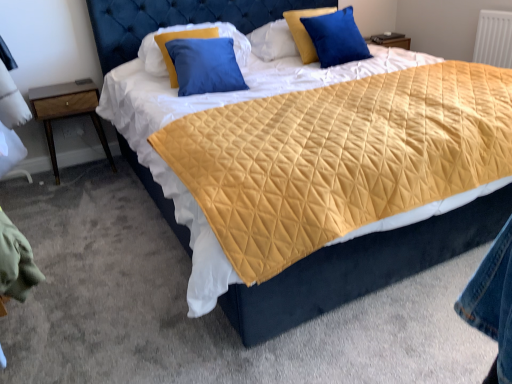
What do you see at coordinates (184, 38) in the screenshot? This screenshot has width=512, height=384. I see `blue velvet pillow at upper center, the 3th pillow in the right-to-left sequence` at bounding box center [184, 38].

Describe the element at coordinates (336, 37) in the screenshot. I see `blue satin pillow at upper right, which ranks as the 1th pillow in right-to-left order` at that location.

In order to click on wooden nightstand at left in this screenshot , I will do `click(67, 111)`.

What's the angular difference between wooden nightstand at left and blue satin pillow at upper right, which ranks as the 1th pillow in right-to-left order,'s facing directions?

The angle between the facing direction of wooden nightstand at left and the facing direction of blue satin pillow at upper right, which ranks as the 1th pillow in right-to-left order, is 5.33 degrees.

From a real-world perspective, relative to blue satin pillow at upper right, which ranks as the 1th pillow in right-to-left order, is wooden nightstand at left vertically above or below?

In terms of real-world spatial position, wooden nightstand at left is below blue satin pillow at upper right, which ranks as the 1th pillow in right-to-left order.

Is wooden nightstand at left bigger than blue satin pillow at upper right, the third pillow positioned from the left?

Correct, wooden nightstand at left is larger in size than blue satin pillow at upper right, the third pillow positioned from the left.

Does wooden nightstand at left come behind blue satin pillow at upper right, which ranks as the 1th pillow in right-to-left order?

Yes, it is.

Is blue satin pillow at upper right, which ranks as the 1th pillow in right-to-left order, located within blue velvet pillow at upper center, arranged as the first pillow when viewed from the left?

No, blue velvet pillow at upper center, arranged as the first pillow when viewed from the left, does not contain blue satin pillow at upper right, which ranks as the 1th pillow in right-to-left order.

From the image's perspective, which one is positioned lower, blue velvet pillow at upper center, arranged as the first pillow when viewed from the left, or blue satin pillow at upper right, which ranks as the 1th pillow in right-to-left order?

blue velvet pillow at upper center, arranged as the first pillow when viewed from the left, appears lower in the image.

Based on the photo, is blue satin pillow at upper right, the third pillow positioned from the left, at the back of blue velvet pillow at upper center, the 3th pillow in the right-to-left sequence?

blue velvet pillow at upper center, the 3th pillow in the right-to-left sequence, does not have its back to blue satin pillow at upper right, the third pillow positioned from the left.

Which object is positioned more to the left, blue velvet pillow at upper center, the 3th pillow in the right-to-left sequence, or blue satin pillow at upper right, which ranks as the 1th pillow in right-to-left order?

blue velvet pillow at upper center, the 3th pillow in the right-to-left sequence.

In terms of width, does blue satin pillow at upper right, which ranks as the 1th pillow in right-to-left order, look wider or thinner when compared to blue velvet pillow at upper center, arranged as the first pillow when viewed from the left?

In the image, blue satin pillow at upper right, which ranks as the 1th pillow in right-to-left order, appears to be more narrow than blue velvet pillow at upper center, arranged as the first pillow when viewed from the left.

From the image's perspective, which pillow is the 1st one above the blue velvet pillow at upper center, arranged as the first pillow when viewed from the left? Please provide its 2D coordinates.

[(336, 37)]

From the picture: Considering the relative sizes of blue satin pillow at upper right, the third pillow positioned from the left, and blue velvet pillow at upper center, the 3th pillow in the right-to-left sequence, in the image provided, is blue satin pillow at upper right, the third pillow positioned from the left, smaller than blue velvet pillow at upper center, the 3th pillow in the right-to-left sequence,?

Yes.

Is blue satin pillow at upper right, which ranks as the 1th pillow in right-to-left order, turned away from blue velvet pillow at upper center, the 3th pillow in the right-to-left sequence?

blue satin pillow at upper right, which ranks as the 1th pillow in right-to-left order, does not have its back to blue velvet pillow at upper center, the 3th pillow in the right-to-left sequence.

Can wooden nightstand at left be found inside blue velvet pillow at upper center, the 3th pillow in the right-to-left sequence?

No, wooden nightstand at left is not inside blue velvet pillow at upper center, the 3th pillow in the right-to-left sequence.

Considering the sizes of objects blue velvet pillow at upper center, the 3th pillow in the right-to-left sequence, and wooden nightstand at left in the image provided, who is shorter, blue velvet pillow at upper center, the 3th pillow in the right-to-left sequence, or wooden nightstand at left?

blue velvet pillow at upper center, the 3th pillow in the right-to-left sequence, is shorter.

Is blue velvet pillow at upper center, the 3th pillow in the right-to-left sequence, placed right next to wooden nightstand at left?

There is a gap between blue velvet pillow at upper center, the 3th pillow in the right-to-left sequence, and wooden nightstand at left.

What are the coordinates of `the 2nd pillow in front when counting from the wooden nightstand at left` in the screenshot? It's located at [x=184, y=38].

Can you confirm if wooden nightstand at left is taller than blue velvet pillow at upper center, the 3th pillow in the right-to-left sequence?

Correct, wooden nightstand at left is much taller as blue velvet pillow at upper center, the 3th pillow in the right-to-left sequence.

Between wooden nightstand at left and blue velvet pillow at upper center, the 3th pillow in the right-to-left sequence, which one is positioned behind?

wooden nightstand at left.

From a real-world perspective, which object stands above the other?

blue velvet pillow at upper center, arranged as the first pillow when viewed from the left, from a real-world perspective.

Can you confirm if blue velvet pillow at upper center, the 3th pillow in the right-to-left sequence, is wider than velvet blue pillow at upper center, the 2th pillow positioned from the left?

Indeed, blue velvet pillow at upper center, the 3th pillow in the right-to-left sequence, has a greater width compared to velvet blue pillow at upper center, the 2th pillow positioned from the left.

Is velvet blue pillow at upper center, the 2th pillow positioned from the left, surrounded by blue velvet pillow at upper center, arranged as the first pillow when viewed from the left?

No, velvet blue pillow at upper center, the 2th pillow positioned from the left, is not a part of blue velvet pillow at upper center, arranged as the first pillow when viewed from the left.

Is blue velvet pillow at upper center, the 3th pillow in the right-to-left sequence, facing towards velvet blue pillow at upper center, the second pillow viewed from the right?

No, blue velvet pillow at upper center, the 3th pillow in the right-to-left sequence, is not facing towards velvet blue pillow at upper center, the second pillow viewed from the right.

Considering the positions of objects velvet blue pillow at upper center, the second pillow viewed from the right, and blue satin pillow at upper right, the third pillow positioned from the left, in the image provided, who is behind, velvet blue pillow at upper center, the second pillow viewed from the right, or blue satin pillow at upper right, the third pillow positioned from the left,?

velvet blue pillow at upper center, the second pillow viewed from the right, is further from the camera.

Does velvet blue pillow at upper center, the second pillow viewed from the right, turn towards blue satin pillow at upper right, which ranks as the 1th pillow in right-to-left order?

Yes, velvet blue pillow at upper center, the second pillow viewed from the right, is facing blue satin pillow at upper right, which ranks as the 1th pillow in right-to-left order.

Are velvet blue pillow at upper center, the 2th pillow positioned from the left, and blue satin pillow at upper right, which ranks as the 1th pillow in right-to-left order, beside each other?

No, velvet blue pillow at upper center, the 2th pillow positioned from the left, is not next to blue satin pillow at upper right, which ranks as the 1th pillow in right-to-left order.

From a real-world perspective, is velvet blue pillow at upper center, the second pillow viewed from the right, positioned under blue satin pillow at upper right, the third pillow positioned from the left, based on gravity?

Correct, in the physical world, velvet blue pillow at upper center, the second pillow viewed from the right, is lower than blue satin pillow at upper right, the third pillow positioned from the left.

Image resolution: width=512 pixels, height=384 pixels. I want to click on the 3rd pillow to the right when counting from the wooden nightstand at left, so click(x=336, y=37).

Locate an element on the screen. This screenshot has width=512, height=384. pillow that is below the blue satin pillow at upper right, which ranks as the 1th pillow in right-to-left order (from the image's perspective) is located at coordinates (184, 38).

Which object lies nearer to the anchor point blue velvet pillow at upper center, the 3th pillow in the right-to-left sequence, blue satin pillow at upper right, the third pillow positioned from the left, or velvet blue pillow at upper center, the second pillow viewed from the right?

velvet blue pillow at upper center, the second pillow viewed from the right, is closer to blue velvet pillow at upper center, the 3th pillow in the right-to-left sequence.

Considering their positions, is blue satin pillow at upper right, the third pillow positioned from the left, positioned closer to blue velvet pillow at upper center, the 3th pillow in the right-to-left sequence, than wooden nightstand at left?

wooden nightstand at left is positioned closer to the anchor blue velvet pillow at upper center, the 3th pillow in the right-to-left sequence.

Looking at the image, which one is located closer to wooden nightstand at left, blue satin pillow at upper right, which ranks as the 1th pillow in right-to-left order, or velvet blue pillow at upper center, the second pillow viewed from the right?

velvet blue pillow at upper center, the second pillow viewed from the right, is closer to wooden nightstand at left.

Considering their positions, is wooden nightstand at left positioned further to blue velvet pillow at upper center, the 3th pillow in the right-to-left sequence, than blue satin pillow at upper right, which ranks as the 1th pillow in right-to-left order?

blue satin pillow at upper right, which ranks as the 1th pillow in right-to-left order, is further to blue velvet pillow at upper center, the 3th pillow in the right-to-left sequence.

Estimate the real-world distances between objects in this image. Which object is further from blue satin pillow at upper right, the third pillow positioned from the left, wooden nightstand at left or velvet blue pillow at upper center, the second pillow viewed from the right?

Based on the image, wooden nightstand at left appears to be further to blue satin pillow at upper right, the third pillow positioned from the left.

From the image, which object appears to be nearer to wooden nightstand at left, velvet blue pillow at upper center, the 2th pillow positioned from the left, or blue velvet pillow at upper center, the 3th pillow in the right-to-left sequence?

blue velvet pillow at upper center, the 3th pillow in the right-to-left sequence.

Which object lies nearer to the anchor point velvet blue pillow at upper center, the 2th pillow positioned from the left, blue satin pillow at upper right, the third pillow positioned from the left, or blue velvet pillow at upper center, arranged as the first pillow when viewed from the left?

Among the two, blue satin pillow at upper right, the third pillow positioned from the left, is located nearer to velvet blue pillow at upper center, the 2th pillow positioned from the left.

Looking at the image, which one is located further to wooden nightstand at left, blue velvet pillow at upper center, arranged as the first pillow when viewed from the left, or velvet blue pillow at upper center, the second pillow viewed from the right?

velvet blue pillow at upper center, the second pillow viewed from the right, is positioned further to the anchor wooden nightstand at left.

Where is `pillow located between wooden nightstand at left and velvet blue pillow at upper center, the 2th pillow positioned from the left, in the left-right direction`? This screenshot has height=384, width=512. pillow located between wooden nightstand at left and velvet blue pillow at upper center, the 2th pillow positioned from the left, in the left-right direction is located at coordinates (184, 38).

At what (x,y) coordinates should I click in order to perform the action: click on pillow situated between blue velvet pillow at upper center, arranged as the first pillow when viewed from the left, and blue satin pillow at upper right, the third pillow positioned from the left, from left to right. Please return your answer as a coordinate pair (x, y). The height and width of the screenshot is (384, 512). Looking at the image, I should click on (287, 37).